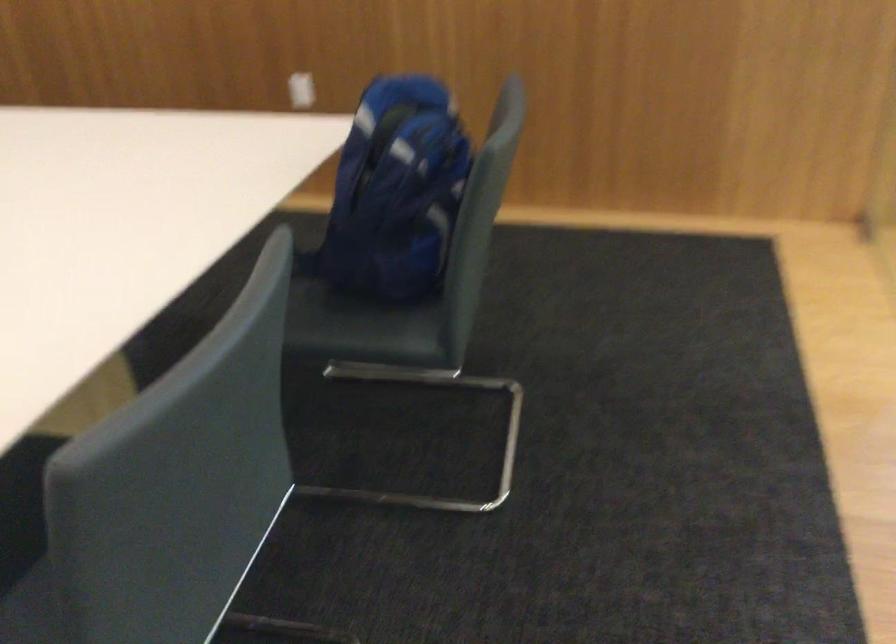
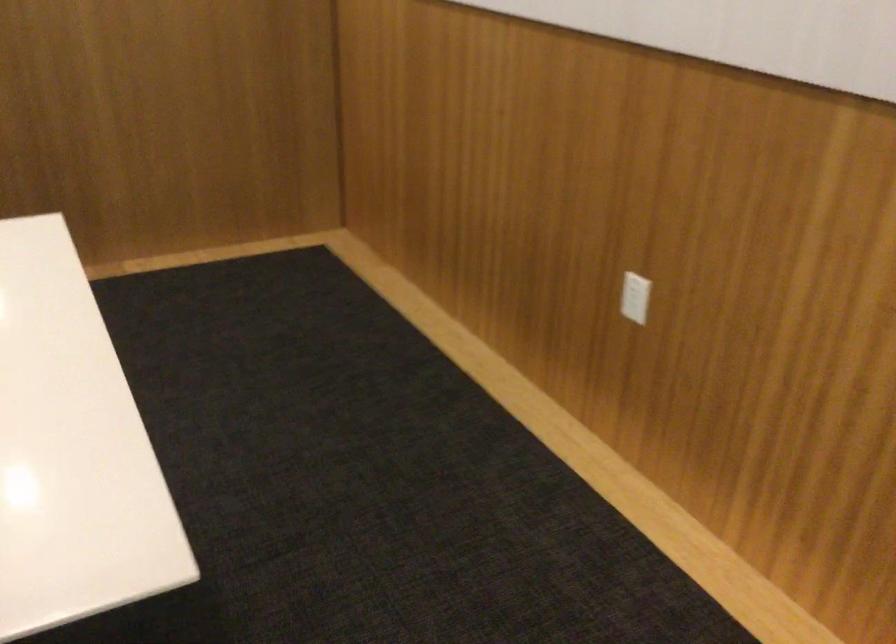
The point at (295, 77) is marked in the first image. Where is the corresponding point in the second image?

(634, 297)